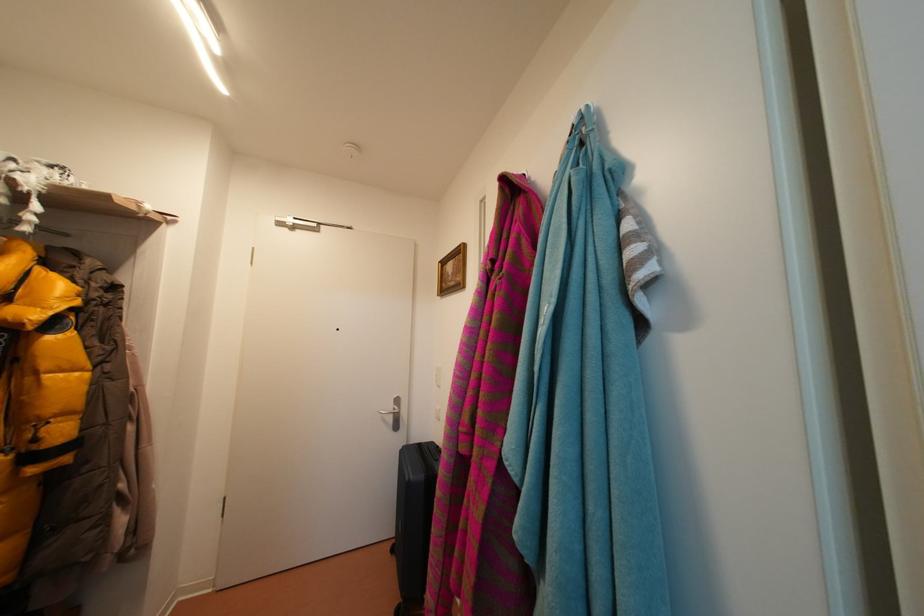
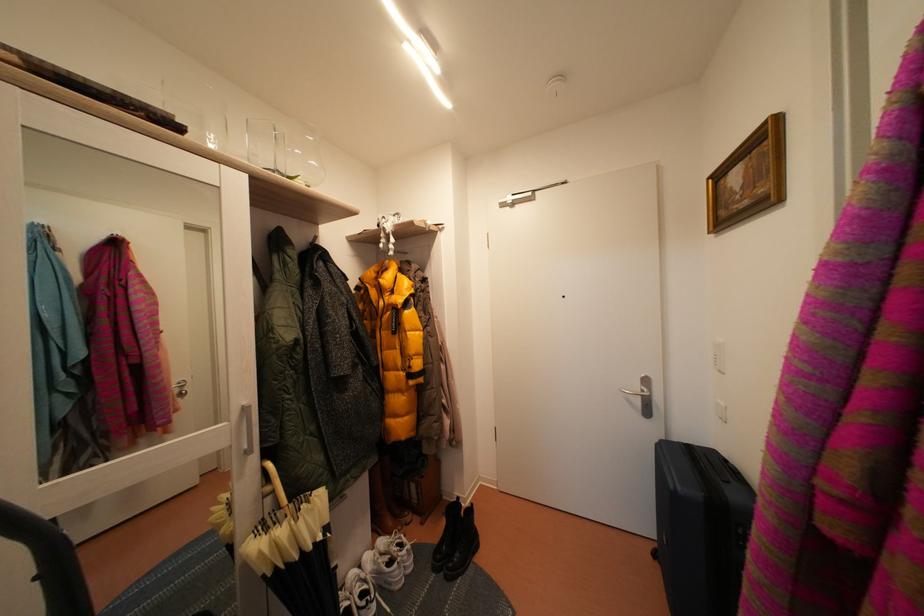
In the second image, find the point that corresponds to pixel 398 411 in the first image.

(645, 392)